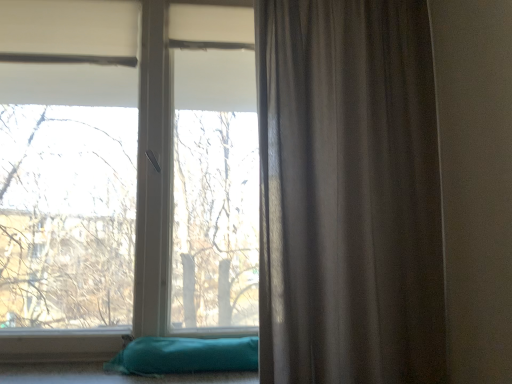
Question: Is teal fabric pillow at lower left positioned before transparent glass window at center?

Choices:
 (A) no
 (B) yes

Answer: (B)

Question: Is teal fabric pillow at lower left with transparent glass window at center?

Choices:
 (A) yes
 (B) no

Answer: (B)

Question: Considering the relative sizes of teal fabric pillow at lower left and transparent glass window at center in the image provided, is teal fabric pillow at lower left bigger than transparent glass window at center?

Choices:
 (A) no
 (B) yes

Answer: (A)

Question: Is teal fabric pillow at lower left wider than transparent glass window at center?

Choices:
 (A) yes
 (B) no

Answer: (A)

Question: From a real-world perspective, is teal fabric pillow at lower left beneath transparent glass window at center?

Choices:
 (A) yes
 (B) no

Answer: (A)

Question: From the image's perspective, does teal fabric pillow at lower left appear lower than transparent glass window at center?

Choices:
 (A) no
 (B) yes

Answer: (B)

Question: Can you confirm if satin gray curtain at right is bigger than teal fabric pillow at lower left?

Choices:
 (A) yes
 (B) no

Answer: (A)

Question: Is satin gray curtain at right turned away from teal fabric pillow at lower left?

Choices:
 (A) yes
 (B) no

Answer: (B)

Question: Considering the relative positions of satin gray curtain at right and teal fabric pillow at lower left in the image provided, is satin gray curtain at right in front of teal fabric pillow at lower left?

Choices:
 (A) no
 (B) yes

Answer: (B)

Question: Is satin gray curtain at right taller than teal fabric pillow at lower left?

Choices:
 (A) no
 (B) yes

Answer: (B)

Question: Is satin gray curtain at right positioned beyond the bounds of teal fabric pillow at lower left?

Choices:
 (A) yes
 (B) no

Answer: (A)

Question: Is satin gray curtain at right wider than teal fabric pillow at lower left?

Choices:
 (A) yes
 (B) no

Answer: (B)

Question: Is transparent glass window at center positioned before satin gray curtain at right?

Choices:
 (A) yes
 (B) no

Answer: (B)